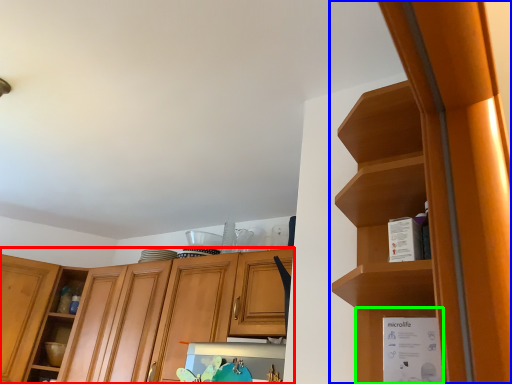
Question: Considering the real-world distances, which object is closest to cabinetry (highlighted by a red box)? cabinetry (highlighted by a blue box) or cabinet (highlighted by a green box).

Choices:
 (A) cabinetry
 (B) cabinet

Answer: (A)